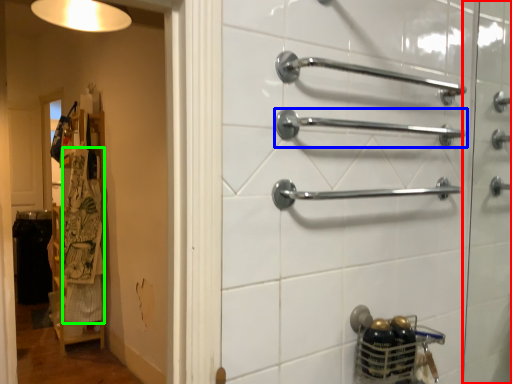
Question: Which object is positioned farthest from screen door (highlighted by a red box)? Select from towel rack (highlighted by a blue box) and laundry (highlighted by a green box).

Choices:
 (A) towel rack
 (B) laundry

Answer: (B)